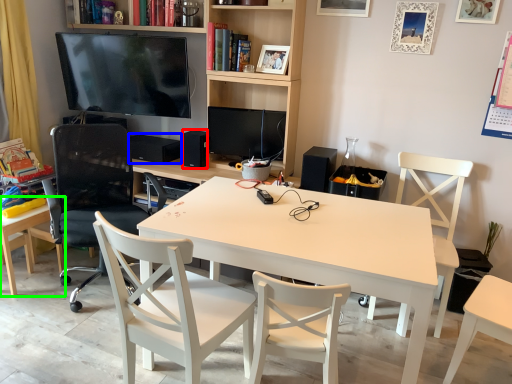
Question: Considering the real-world distances, which object is closest to speaker (highlighted by a red box)? speaker (highlighted by a blue box) or desk (highlighted by a green box).

Choices:
 (A) speaker
 (B) desk

Answer: (A)